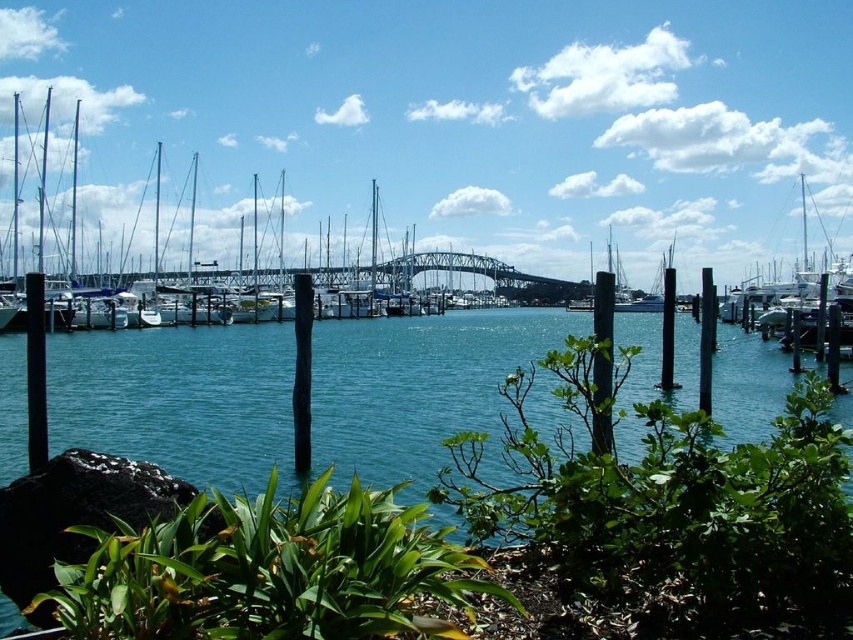
You are a delivery drone with a wingspan of 1.5 meters. You need to fly from the black matte pole at left to the black wood post at center. Is there enough space between them for your flight path?

The distance between the black matte pole at left and the black wood post at center is 32.60 meters, which is more than sufficient for a delivery drone with a 1.5 meter wingspan to safely navigate the space between them.

You are a photographer planning to capture the marina scene. You want to ensure that both the clear blue water at center and the black matte pole at left are visible in your shot. Given their sizes, which object will occupy more of the frame?

The clear blue water at center is larger in size than the black matte pole at left, so it will occupy more of the frame.